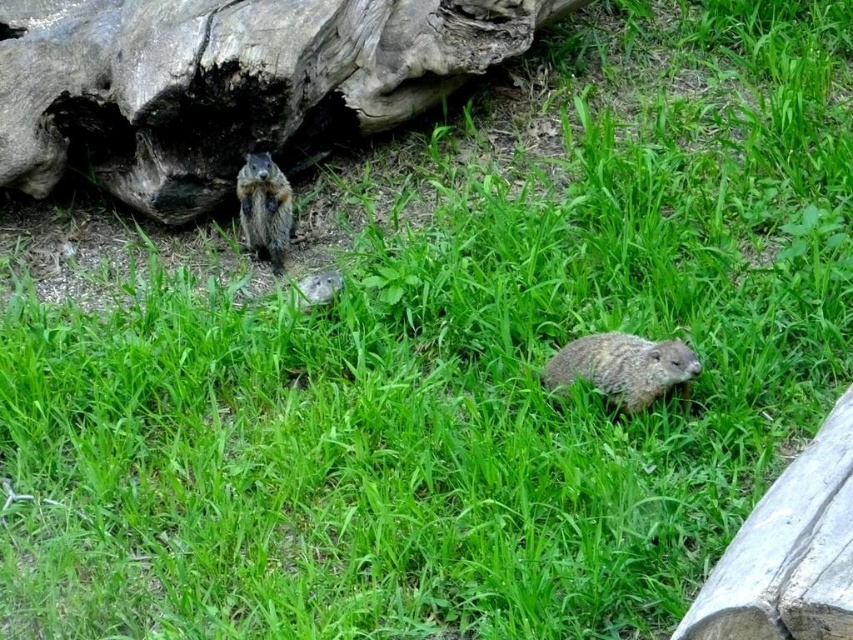
Question: Which point is farther to the camera?

Choices:
 (A) click(254, 224)
 (B) click(653, 340)
 (C) click(183, 147)

Answer: (A)

Question: From the image, what is the correct spatial relationship of weathered wood log at upper left in relation to brown furry squirrel at center?

Choices:
 (A) left
 (B) right

Answer: (B)

Question: Is the position of weathered wood log at upper left more distant than that of brown furry squirrel at center?

Choices:
 (A) no
 (B) yes

Answer: (A)

Question: Does brown fuzzy beaver at lower center have a greater width compared to brown furry squirrel at center?

Choices:
 (A) no
 (B) yes

Answer: (B)

Question: Which object is positioned farthest from the brown furry squirrel at center?

Choices:
 (A) weathered wood log at upper left
 (B) brown fuzzy beaver at lower center

Answer: (B)

Question: Which point is closer to the camera taking this photo?

Choices:
 (A) (660, 376)
 (B) (177, 48)
 (C) (257, 180)

Answer: (A)